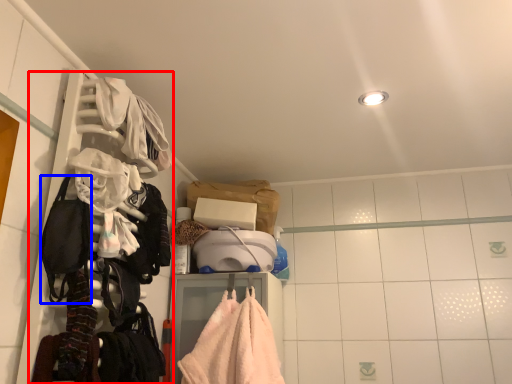
Question: Which point is further to the camera, closet (highlighted by a red box) or gear (highlighted by a blue box)?

Choices:
 (A) closet
 (B) gear

Answer: (B)